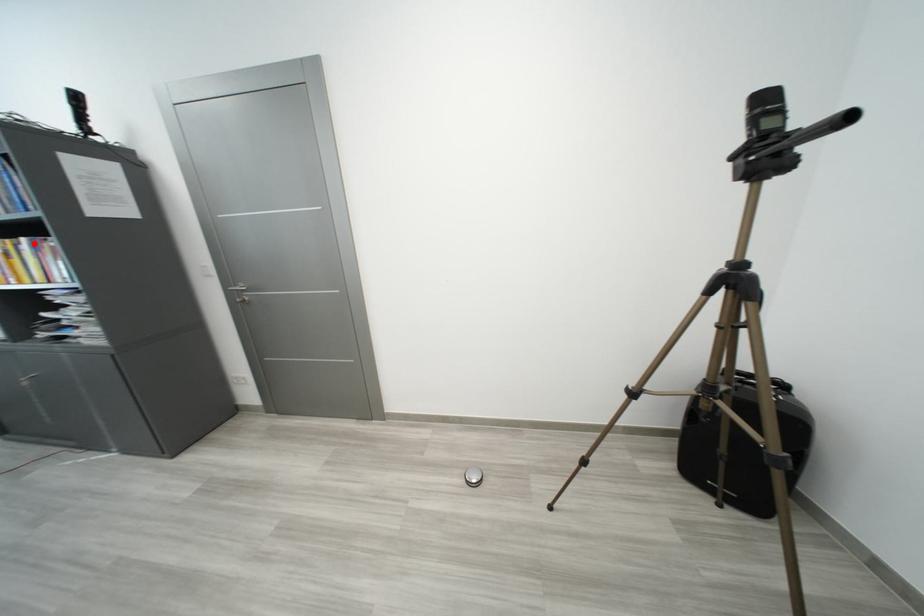
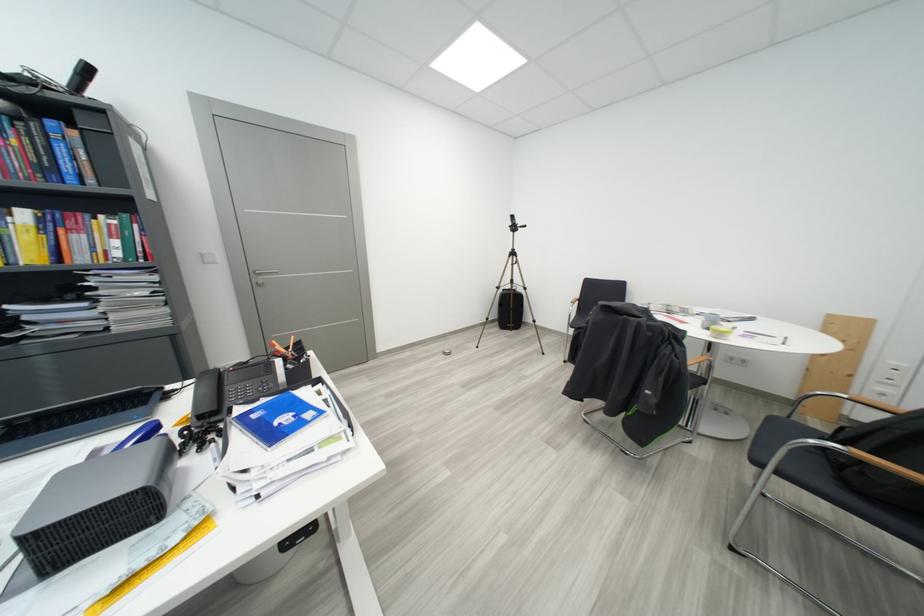
Where in the second image is the point corresponding to the highlighted location from the first image?

(32, 216)